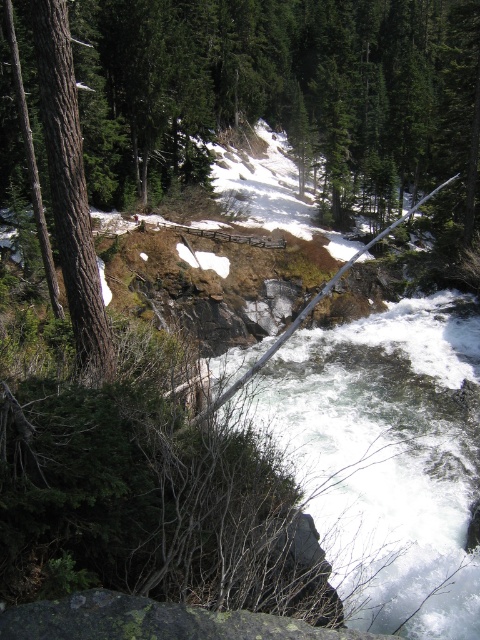
Question: Which object appears closest to the camera in this image?

Choices:
 (A) green mossy rock at lower center
 (B) white frothy water at center
 (C) brown rough tree trunk at left
 (D) brown rough tree at center

Answer: (A)

Question: Among these objects, which one is nearest to the camera?

Choices:
 (A) green mossy rock at lower center
 (B) white frothy water at center
 (C) brown rough tree at center
 (D) brown rough tree trunk at left

Answer: (A)

Question: Can you confirm if white frothy water at center is positioned to the left of green mossy rock at lower center?

Choices:
 (A) yes
 (B) no

Answer: (B)

Question: Based on their relative distances, which object is nearer to the white frothy water at center?

Choices:
 (A) green mossy rock at lower center
 (B) brown rough tree trunk at left
 (C) brown rough tree at center

Answer: (B)

Question: Is the position of brown rough tree at center less distant than that of white frothy water at center?

Choices:
 (A) yes
 (B) no

Answer: (B)

Question: From the image, what is the correct spatial relationship of white frothy water at center in relation to green mossy rock at lower center?

Choices:
 (A) left
 (B) right

Answer: (B)